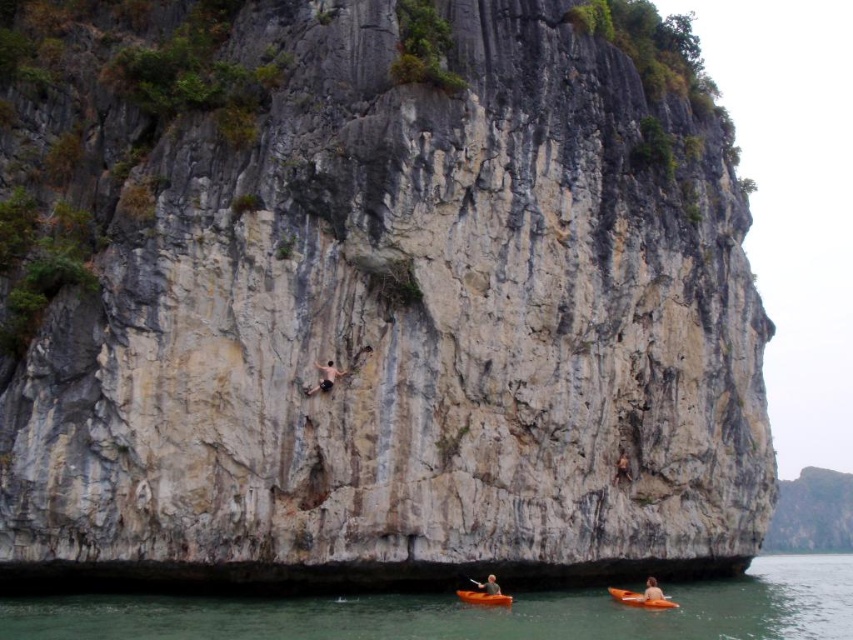
You are a kayaker planning to navigate between the green water at lower center and the orange kayak at lower center. Given that your kayak is 4 meters long, will there be enough space to pass through the gap between them?

The distance between the green water at lower center and the orange kayak at lower center is 17.54 meters. Since your kayak is only 4 meters long, there is more than enough space to safely pass through the gap between them.

You are a photographer trying to capture the orange kayak at lower center and the green water at lower center in a single shot. Which object should you adjust your camera to focus on first if you want to include both in your frame?

The orange kayak at lower center should be focused on first because the green water at lower center is positioned to its right, allowing you to adjust the frame to include both.